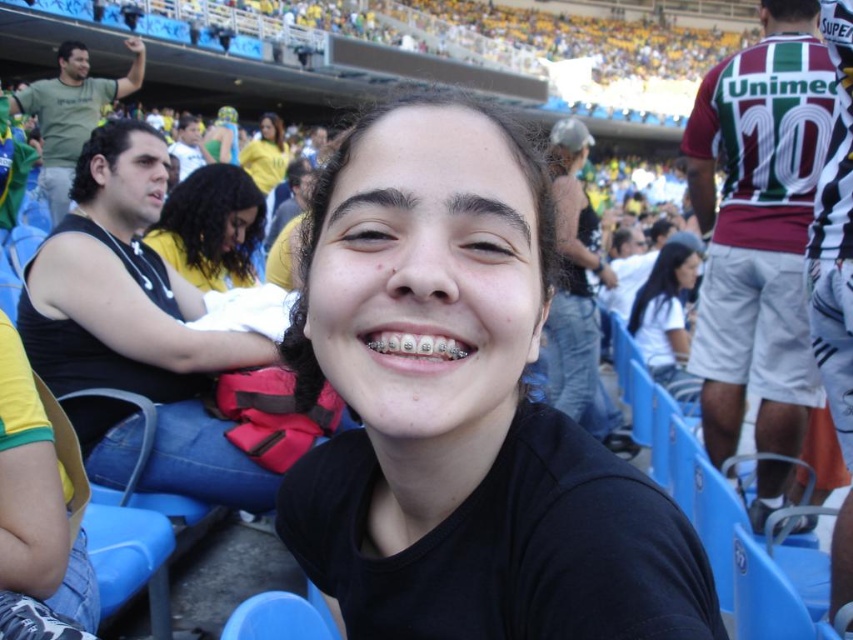
Can you confirm if black matte shirt at center is positioned above black matte hair at center?

Incorrect, black matte shirt at center is not positioned above black matte hair at center.

Which is above, black matte shirt at center or black matte hair at center?

black matte hair at center is higher up.

Where is `black matte shirt at center`? This screenshot has height=640, width=853. black matte shirt at center is located at coordinates (461, 408).

Locate an element on the screen. black matte shirt at center is located at coordinates (461, 408).

Who is higher up, black matte shirt at center or yellow jersey at upper center?

yellow jersey at upper center

Is black matte shirt at center closer to the viewer compared to yellow jersey at upper center?

Yes, it is in front of yellow jersey at upper center.

Based on the photo, who is more distant from viewer, (544, 440) or (263, 124)?

The point (263, 124) is more distant.

Where is `black matte shirt at center`? black matte shirt at center is located at coordinates (461, 408).

Is point (241, 266) positioned behind point (689, 275)?

No, (241, 266) is closer to viewer.

Between point (241, 264) and point (670, 332), which one is positioned in front?

Point (241, 264)

Is point (196, 236) behind point (656, 310)?

No, (196, 236) is in front of (656, 310).

What are the coordinates of `dark brown hair at center` in the screenshot? It's located at (212, 227).